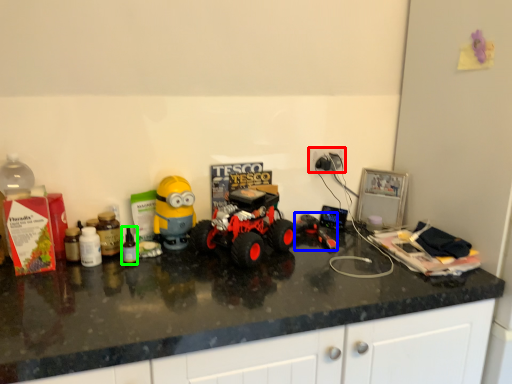
Question: Which is farther away from electric outlet (highlighted by a red box)? toy (highlighted by a blue box) or bottle (highlighted by a green box)?

Choices:
 (A) toy
 (B) bottle

Answer: (B)